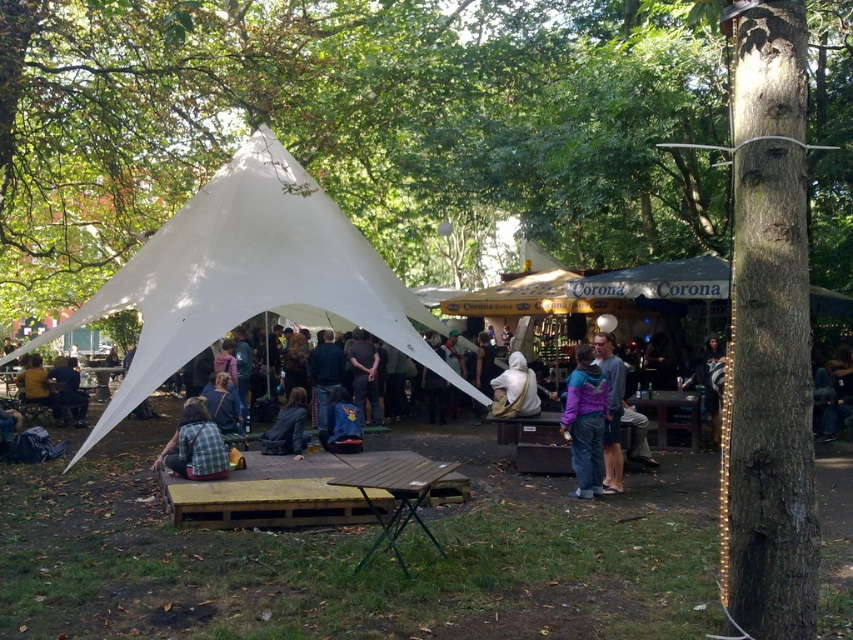
Who is lower down, purple fleece jacket at center or plaid fabric shirt at center?

plaid fabric shirt at center is lower down.

Does purple fleece jacket at center have a greater height compared to plaid fabric shirt at center?

Indeed, purple fleece jacket at center has a greater height compared to plaid fabric shirt at center.

Identify the location of purple fleece jacket at center. (585, 420).

The height and width of the screenshot is (640, 853). What do you see at coordinates (248, 276) in the screenshot? I see `white fabric tent at left` at bounding box center [248, 276].

Looking at this image, can you confirm if white fabric tent at left is positioned below blue fabric bag at center?

No.

Identify the location of white fabric tent at left. The width and height of the screenshot is (853, 640). pyautogui.click(x=248, y=276).

This screenshot has height=640, width=853. Identify the location of white fabric tent at left. (248, 276).

Does white fabric tent at left appear under white fabric bag at center?

No, white fabric tent at left is not below white fabric bag at center.

Does point (312, 228) lie in front of point (521, 412)?

No, it is behind (521, 412).

Find the location of a particular element. white fabric tent at left is located at coordinates (248, 276).